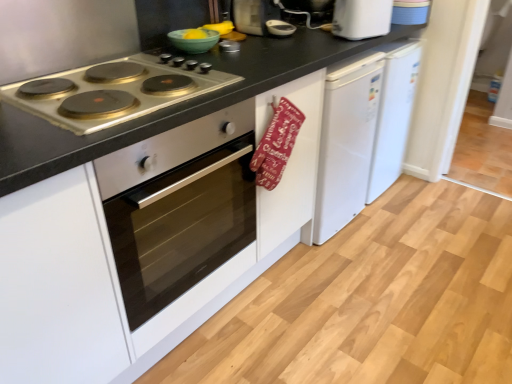
Question: Would you consider red fabric oven mitt at center to be distant from satin silver oven at left?

Choices:
 (A) no
 (B) yes

Answer: (A)

Question: Does red fabric oven mitt at center have a greater width compared to satin silver oven at left?

Choices:
 (A) yes
 (B) no

Answer: (B)

Question: From the image's perspective, is red fabric oven mitt at center located beneath satin silver oven at left?

Choices:
 (A) yes
 (B) no

Answer: (B)

Question: Could you tell me if red fabric oven mitt at center is turned towards satin silver oven at left?

Choices:
 (A) no
 (B) yes

Answer: (A)

Question: Is satin silver oven at left surrounded by red fabric oven mitt at center?

Choices:
 (A) yes
 (B) no

Answer: (B)

Question: Is the surface of red fabric oven mitt at center in direct contact with satin silver oven at left?

Choices:
 (A) no
 (B) yes

Answer: (A)

Question: Is satin silver oven at left oriented towards metallic silver cooktop at left?

Choices:
 (A) yes
 (B) no

Answer: (B)

Question: Does satin silver oven at left appear on the right side of metallic silver cooktop at left?

Choices:
 (A) no
 (B) yes

Answer: (B)

Question: Is satin silver oven at left behind metallic silver cooktop at left?

Choices:
 (A) yes
 (B) no

Answer: (B)

Question: Is satin silver oven at left looking in the opposite direction of metallic silver cooktop at left?

Choices:
 (A) no
 (B) yes

Answer: (A)

Question: Considering the relative sizes of satin silver oven at left and metallic silver cooktop at left in the image provided, is satin silver oven at left shorter than metallic silver cooktop at left?

Choices:
 (A) yes
 (B) no

Answer: (B)

Question: From a real-world perspective, is satin silver oven at left positioned under metallic silver cooktop at left based on gravity?

Choices:
 (A) yes
 (B) no

Answer: (A)

Question: Does white plastic toaster at upper right have a larger size compared to green matte bowl at upper center?

Choices:
 (A) no
 (B) yes

Answer: (B)